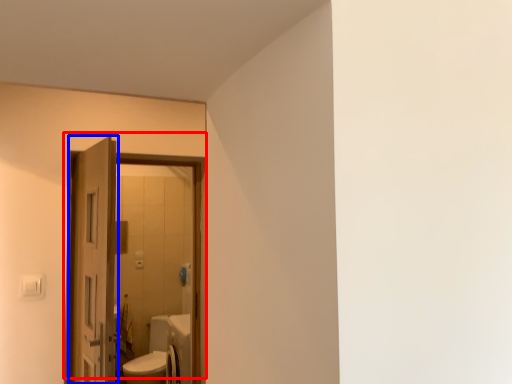
Question: Which point is further to the camera, door (highlighted by a red box) or door (highlighted by a blue box)?

Choices:
 (A) door
 (B) door

Answer: (B)